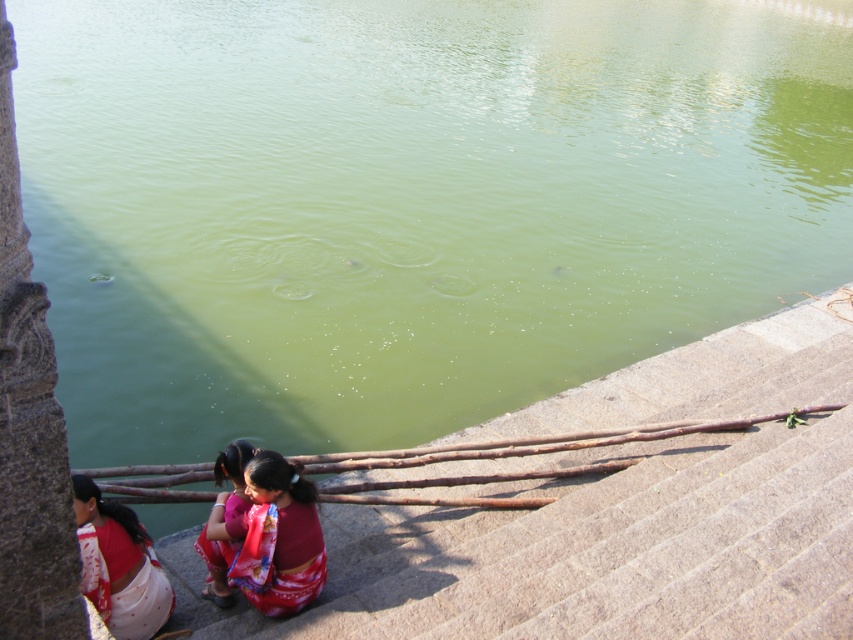
You are standing at the bottom of the stone staircase in the image and want to pick up the white cotton saree at lower left and the red satin saree at lower center. Which saree should you move towards first if you want to collect them in the order from left to right as seen from your current position?

You should first move towards the white cotton saree at lower left because it is positioned to the left of the red satin saree at lower center, so from your current position at the base of the staircase, you would encounter it first when moving from left to right.

Consider the image. You are standing at the bottom of the stone staircase and see the white cotton saree at lower left and the red satin saree at lower center. Which saree is closer to the water?

The white cotton saree at lower left is closer to the water because it is located below the red satin saree at lower center.